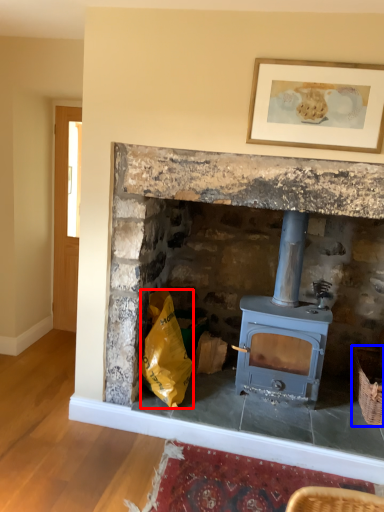
Question: Which point is closer to the camera, material (highlighted by a red box) or basket (highlighted by a blue box)?

Choices:
 (A) material
 (B) basket

Answer: (A)